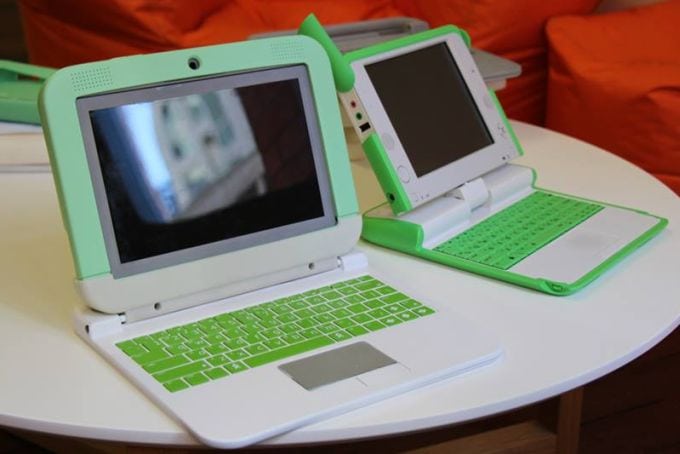
I want to click on black screen, so click(x=230, y=154), click(x=425, y=115).